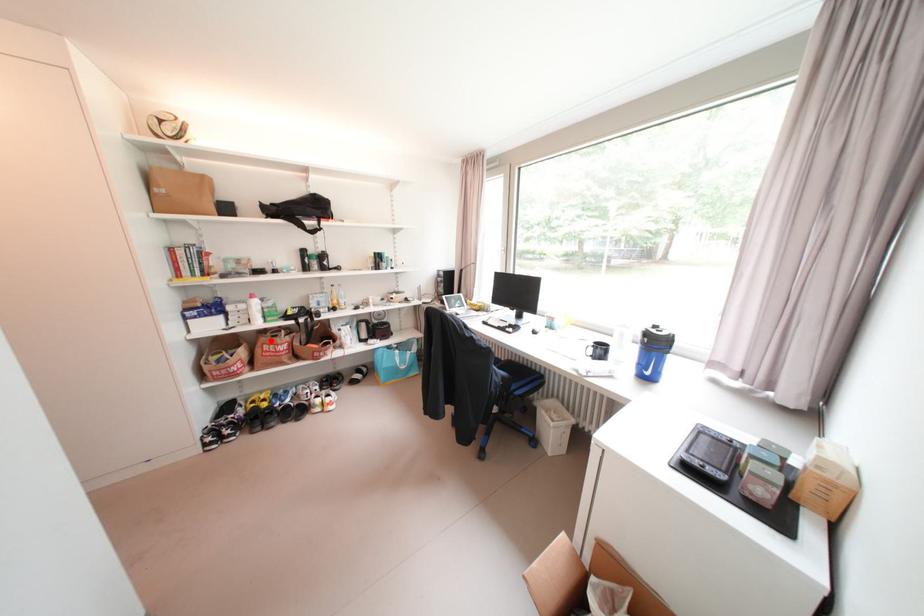
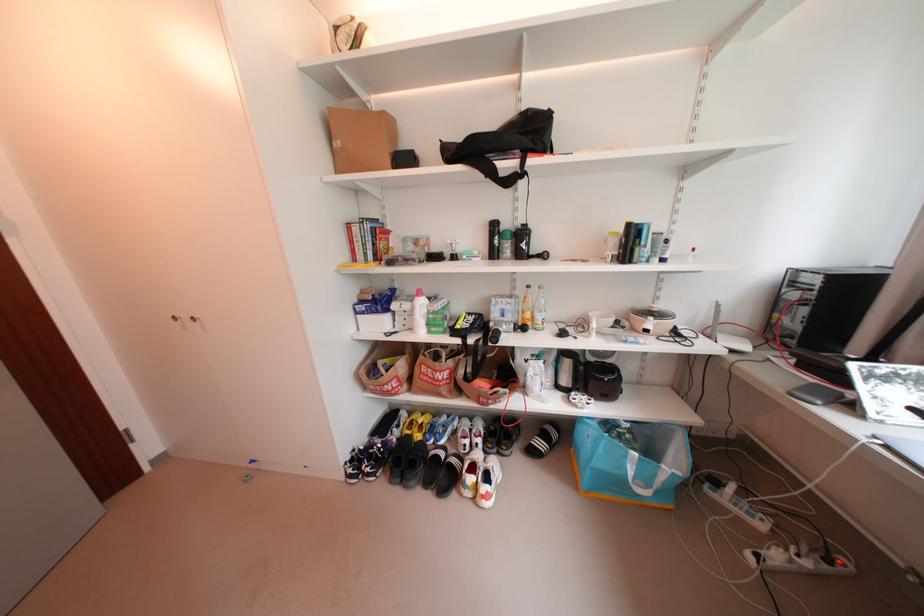
Where in the second image is the point corresponding to the highlighted location from the first image?

(430, 358)